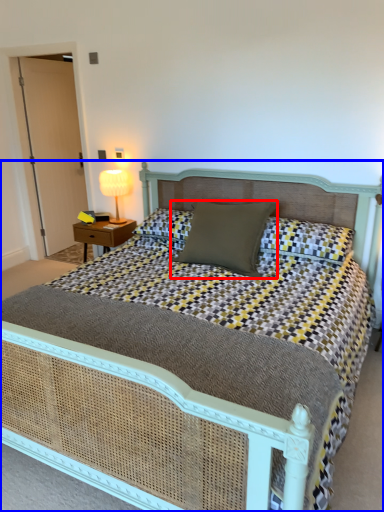
Question: Which object is closer to the camera taking this photo, pillow (highlighted by a red box) or bed (highlighted by a blue box)?

Choices:
 (A) pillow
 (B) bed

Answer: (B)